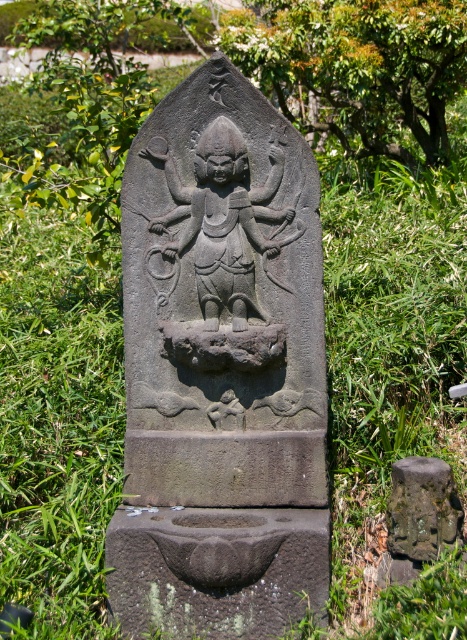
Question: Which object appears closest to the camera in this image?

Choices:
 (A) black stone deity at center
 (B) gray stone statue at center

Answer: (B)

Question: Among these objects, which one is farthest from the camera?

Choices:
 (A) black stone deity at center
 (B) gray stone statue at center

Answer: (A)

Question: Which point is closer to the camera?

Choices:
 (A) (266, 250)
 (B) (273, 529)

Answer: (B)

Question: Is gray stone statue at center wider than black stone deity at center?

Choices:
 (A) no
 (B) yes

Answer: (B)

Question: Does gray stone statue at center appear under black stone deity at center?

Choices:
 (A) no
 (B) yes

Answer: (B)

Question: Is gray stone statue at center behind black stone deity at center?

Choices:
 (A) no
 (B) yes

Answer: (A)